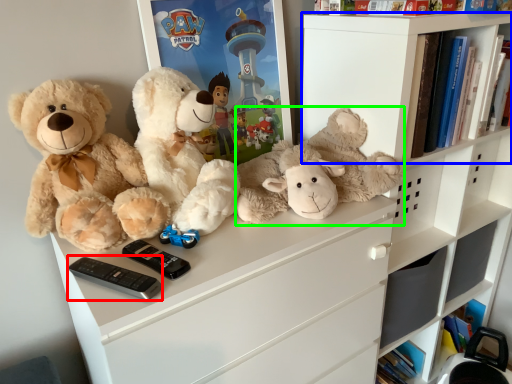
Question: Which is nearer to the control (highlighted by a red box)? shelf (highlighted by a blue box) or teddy bear (highlighted by a green box).

Choices:
 (A) shelf
 (B) teddy bear

Answer: (B)